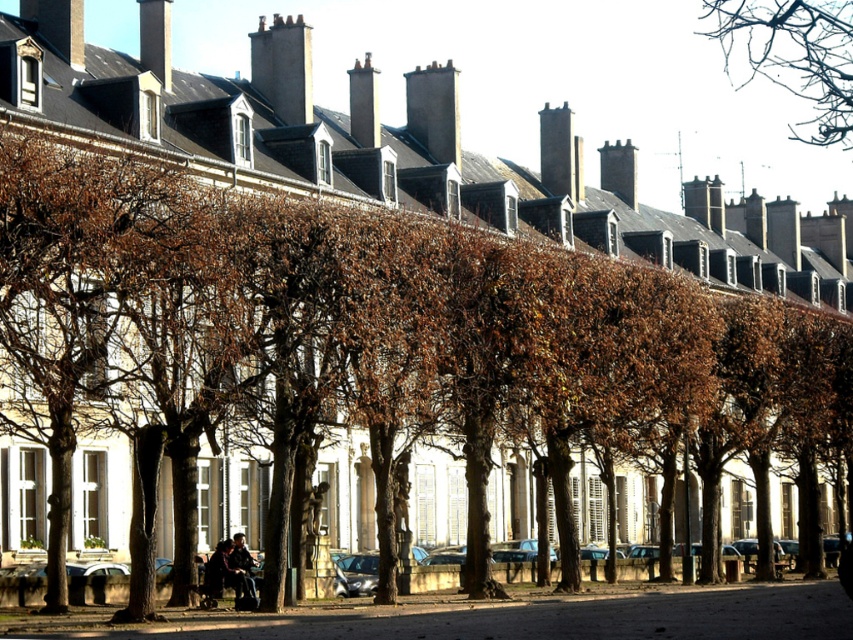
You are an urban planner analyzing this historical district. You notice a point marked at coordinates (x=793, y=54). What does this point indicate in the scene?

The point at coordinates (x=793, y=54) marks the location of brown leafless branches at upper right.

You are a photographer standing at the camera position in the scene. You want to take a closeup shot of the brown leafless branches at upper right. Considering your current distance, is it feasible to capture the branches without moving closer?

The distance between the brown leafless branches at upper right and the camera is 95.69 meters. This distance is too far for a closeup shot without moving closer, so you need to get nearer to the branches to capture them clearly.